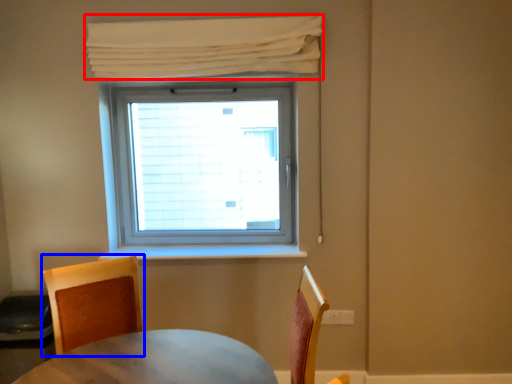
Question: Which object is closer to the camera taking this photo, curtain (highlighted by a red box) or chair (highlighted by a blue box)?

Choices:
 (A) curtain
 (B) chair

Answer: (B)